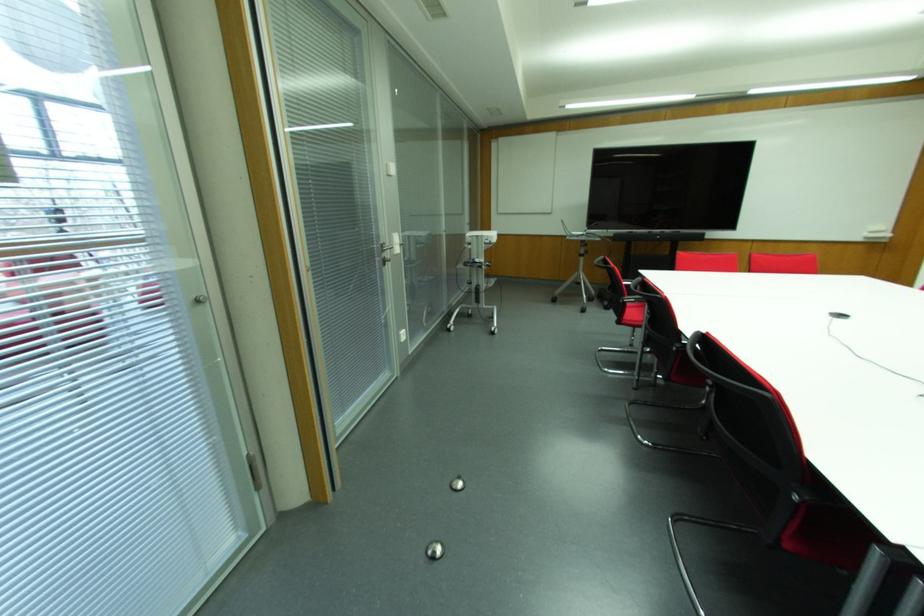
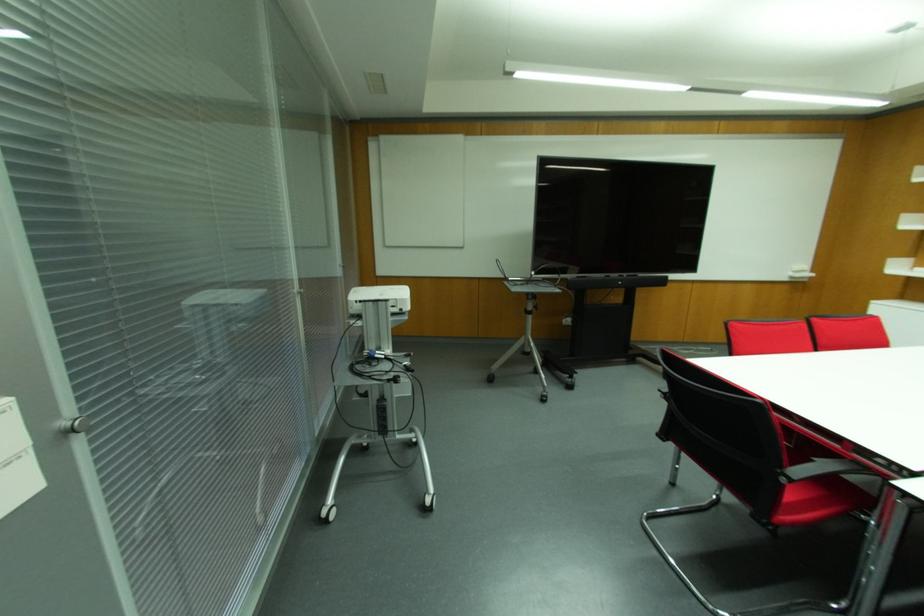
In the second image, find the point that corresponds to [599,238] in the first image.

(556, 290)